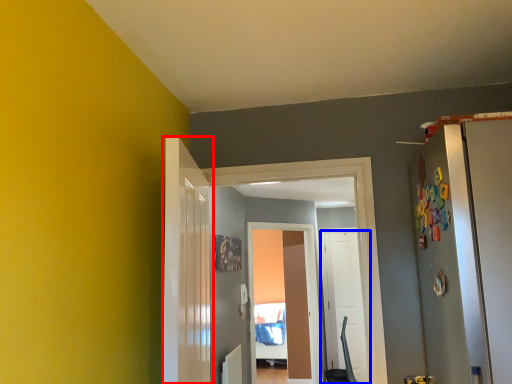
Question: Among these objects, which one is nearest to the camera, door (highlighted by a red box) or door (highlighted by a blue box)?

Choices:
 (A) door
 (B) door

Answer: (A)